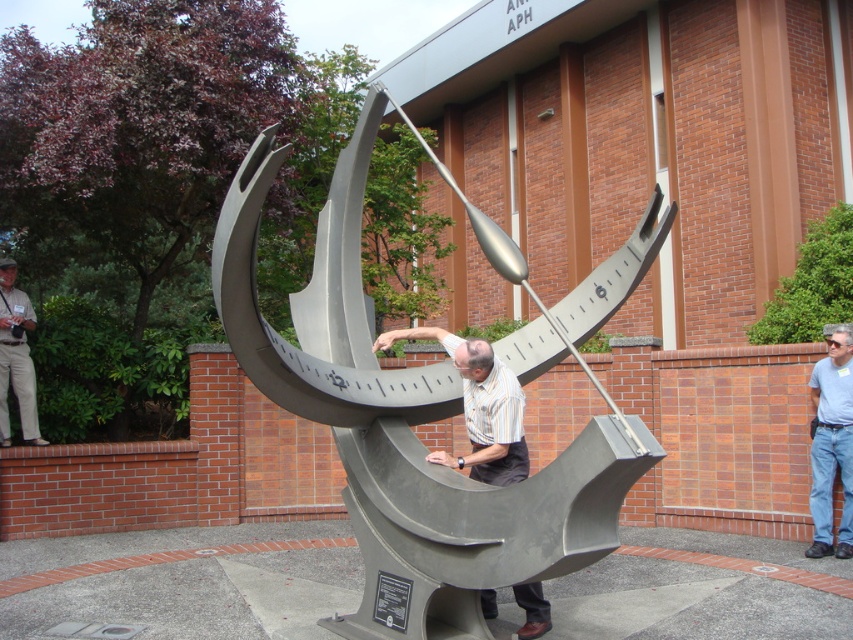
You are standing in front of the sculpture and notice two points on it. The first point is at coordinates point (x=376, y=456) and the second is at point (x=10, y=320). Which of these points is nearer to your viewpoint?

Point (x=376, y=456) is closer to the camera than point (x=10, y=320).